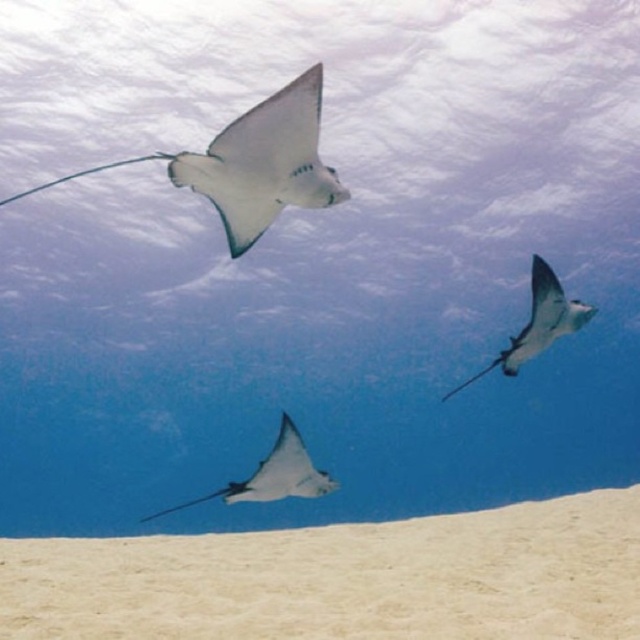
Question: Where is white sandy bottom at lower center located in relation to translucent white stingray at upper center in the image?

Choices:
 (A) below
 (B) above

Answer: (A)

Question: Can you confirm if white sandy bottom at lower center is positioned below translucent white stingray at upper center?

Choices:
 (A) yes
 (B) no

Answer: (A)

Question: Which object is farther from the camera taking this photo?

Choices:
 (A) white sandy bottom at lower center
 (B) translucent white stingray at upper center

Answer: (A)

Question: Does white sandy bottom at lower center have a larger size compared to translucent white stingray at upper center?

Choices:
 (A) yes
 (B) no

Answer: (A)